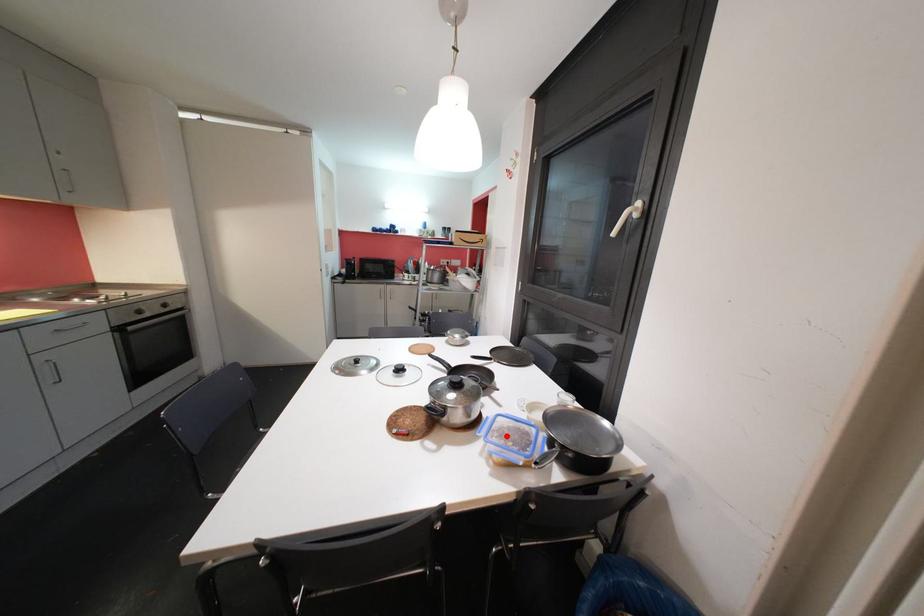
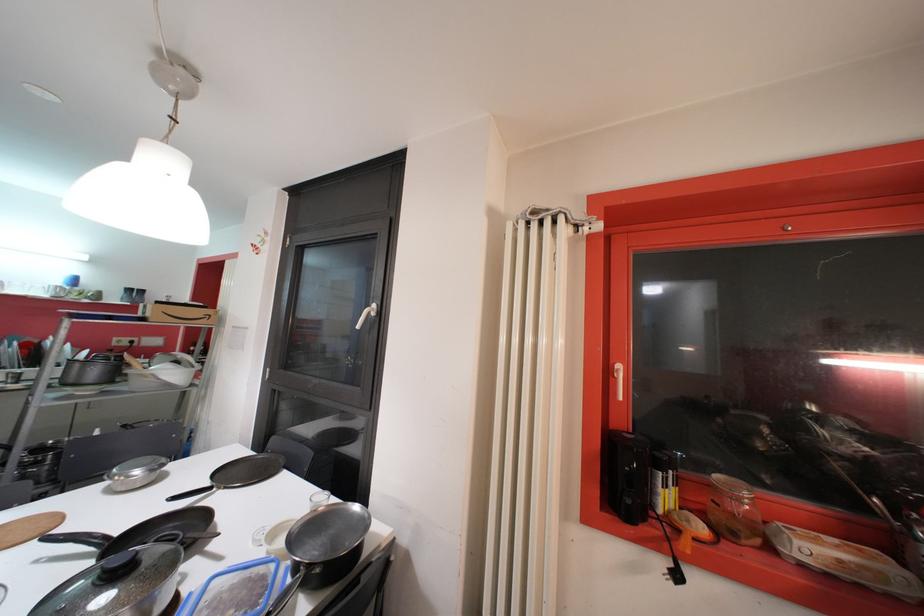
The point at the highlighted location is marked in the first image. Where is the corresponding point in the second image?

(222, 608)